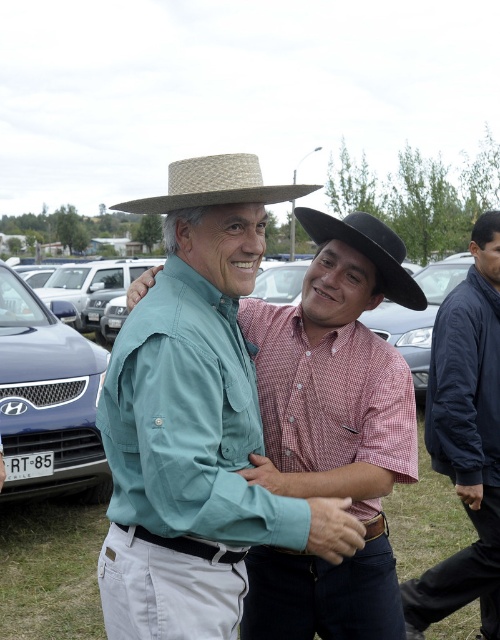
Can you confirm if matte blue car at left is thinner than natural straw cowboy hat at upper center?

No.

Between matte blue car at left and natural straw cowboy hat at upper center, which one appears on the left side from the viewer's perspective?

Positioned to the left is matte blue car at left.

Describe the element at coordinates (48, 400) in the screenshot. I see `matte blue car at left` at that location.

The image size is (500, 640). In order to click on matte blue car at left in this screenshot , I will do `click(48, 400)`.

Is matte blue car at left smaller than black felt fedora at center?

Actually, matte blue car at left might be larger than black felt fedora at center.

Is point (18, 298) closer to viewer compared to point (415, 294)?

That is False.

Between point (68, 388) and point (339, 221), which one is positioned behind?

Positioned behind is point (68, 388).

At what (x,y) coordinates should I click in order to perform the action: click on matte blue car at left. Please return your answer as a coordinate pair (x, y). Looking at the image, I should click on (48, 400).

How much distance is there between red checkered shirt at center and black felt fedora at center?

A distance of 44.17 centimeters exists between red checkered shirt at center and black felt fedora at center.

Does point (353, 212) come behind point (350, 236)?

Yes, it is.

Who is more forward, (325, 620) or (425, 301)?

Positioned in front is point (425, 301).

Image resolution: width=500 pixels, height=640 pixels. Identify the location of red checkered shirt at center. (333, 429).